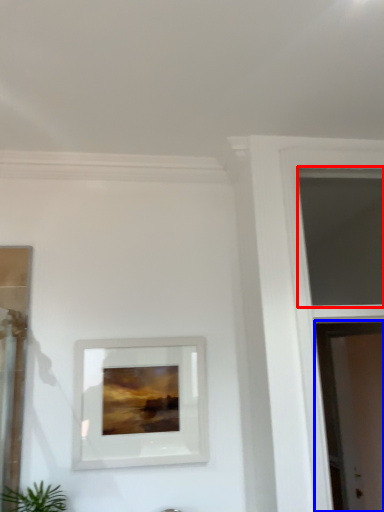
Question: Which point is closer to the camera, window (highlighted by a red box) or screen door (highlighted by a blue box)?

Choices:
 (A) window
 (B) screen door

Answer: (A)